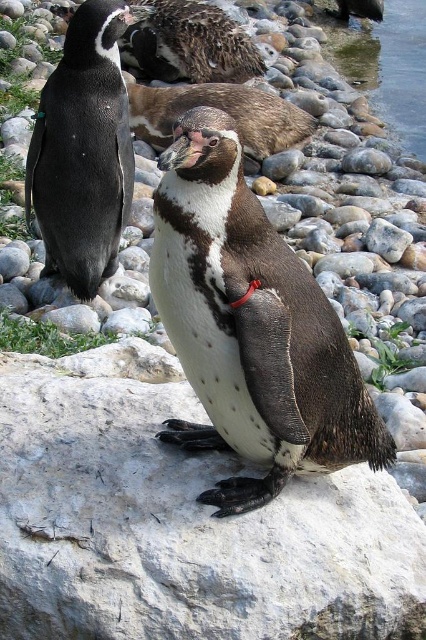
Is white speckled feathers at center below clear water at right?

Correct, white speckled feathers at center is located below clear water at right.

Can you confirm if white speckled feathers at center is smaller than clear water at right?

Yes, white speckled feathers at center is smaller than clear water at right.

Find the location of a particular element. white speckled feathers at center is located at coordinates (250, 326).

Is black glossy penguin at left to the left of clear water at right from the viewer's perspective?

Correct, you'll find black glossy penguin at left to the left of clear water at right.

Does black glossy penguin at left appear on the right side of clear water at right?

Incorrect, black glossy penguin at left is not on the right side of clear water at right.

Is point (81, 118) behind point (408, 80)?

No, (81, 118) is in front of (408, 80).

The width and height of the screenshot is (426, 640). I want to click on black glossy penguin at left, so click(x=83, y=150).

Is point (411, 42) closer to viewer compared to point (279, 104)?

No, it is behind (279, 104).

Between clear water at right and speckled brown penguin at center, which one is positioned lower?

speckled brown penguin at center

Where is `clear water at right`? The image size is (426, 640). clear water at right is located at coordinates (388, 65).